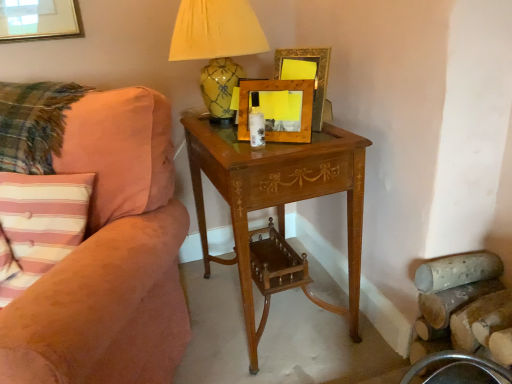
Question: Considering the positions of point pos(214,81) and point pos(294,77), is point pos(214,81) closer or farther from the camera than point pos(294,77)?

Choices:
 (A) farther
 (B) closer

Answer: (A)

Question: In terms of height, does yellow glazed ceramic lamp at upper center look taller or shorter compared to wooden picture frame at upper center, the 1th picture frame in the back-to-front sequence?

Choices:
 (A) tall
 (B) short

Answer: (A)

Question: Which object is the closest to the yellow glazed ceramic lamp at upper center?

Choices:
 (A) wooden picture frame at upper center, the 1th picture frame in the back-to-front sequence
 (B) wooden picture frame at center, which appears as the second picture frame when viewed from the back
 (C) light brown wood nightstand at center
 (D) pink striped fabric pillow at left
 (E) suede-like peach couch at left

Answer: (A)

Question: Based on their relative distances, which object is nearer to the wooden picture frame at center, arranged as the 1th picture frame when viewed from the front?

Choices:
 (A) pink striped fabric pillow at left
 (B) suede-like peach couch at left
 (C) light brown wood nightstand at center
 (D) yellow glazed ceramic lamp at upper center
 (E) wooden picture frame at upper center, the 1th picture frame in the back-to-front sequence

Answer: (E)